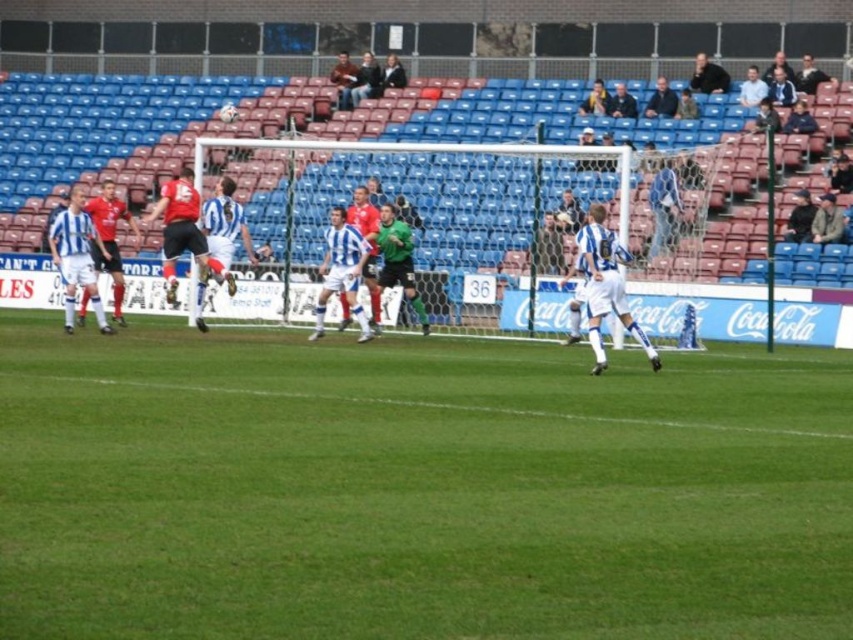
Is point (706, 74) in front of point (822, 74)?

No, it is behind (822, 74).

Between dark blue shirt at upper center and dark blue shirt at upper right, which one appears on the left side from the viewer's perspective?

Positioned to the left is dark blue shirt at upper center.

Locate an element on the screen. This screenshot has height=640, width=853. dark blue shirt at upper center is located at coordinates (708, 76).

Image resolution: width=853 pixels, height=640 pixels. What are the coordinates of `dark blue shirt at upper center` in the screenshot? It's located at (708, 76).

Between green grass at lower center and dark blue jersey at upper center, which one is positioned lower?

green grass at lower center is below.

Between green grass at lower center and dark blue jersey at upper center, which one appears on the left side from the viewer's perspective?

green grass at lower center is more to the left.

Is point (608, 422) closer to camera compared to point (606, 104)?

Yes, point (608, 422) is closer to viewer.

Identify the location of green grass at lower center. This screenshot has height=640, width=853. (428, 404).

I want to click on dark blue shirt at upper center, so click(x=708, y=76).

In the scene shown: Is dark blue shirt at upper center thinner than dark blue jacket at upper right?

No, dark blue shirt at upper center is not thinner than dark blue jacket at upper right.

Is point (714, 80) positioned in front of point (650, 106)?

No, it is not.

The height and width of the screenshot is (640, 853). Identify the location of dark blue shirt at upper center. (708, 76).